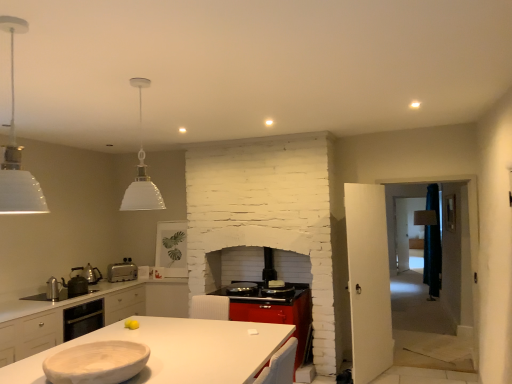
Where is `free space to the right of metallic silver kettle at left, the 3th appliance from the back`? This screenshot has height=384, width=512. free space to the right of metallic silver kettle at left, the 3th appliance from the back is located at coordinates (69, 302).